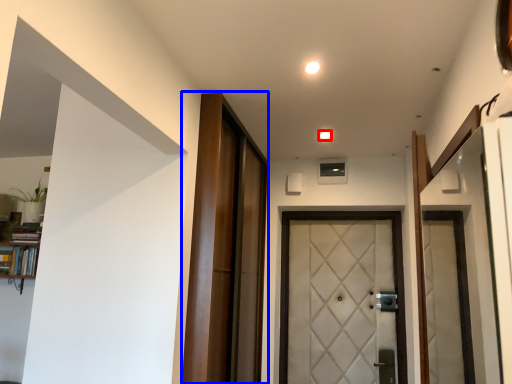
Question: Which of the following is the closest to the observer, light (highlighted by a red box) or barn door (highlighted by a blue box)?

Choices:
 (A) light
 (B) barn door

Answer: (B)